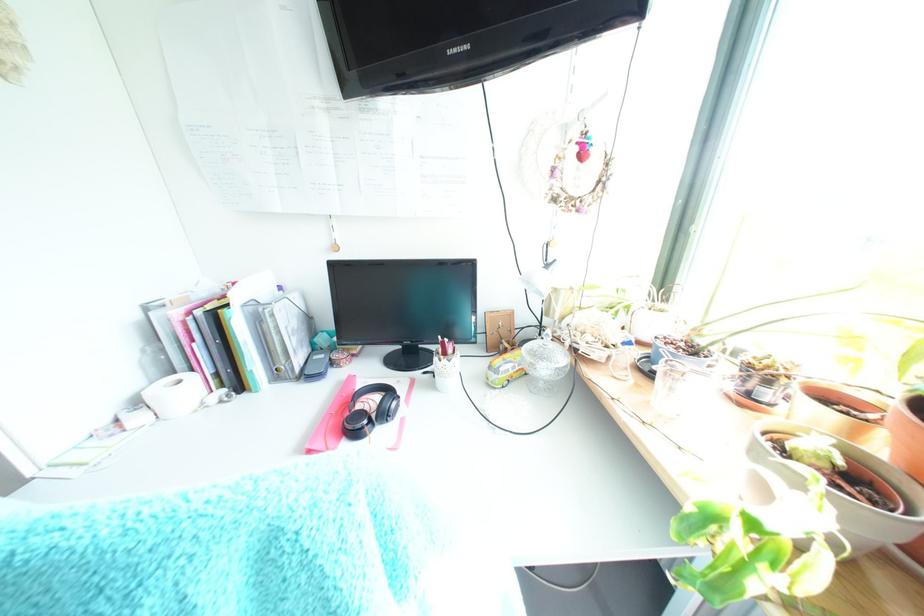
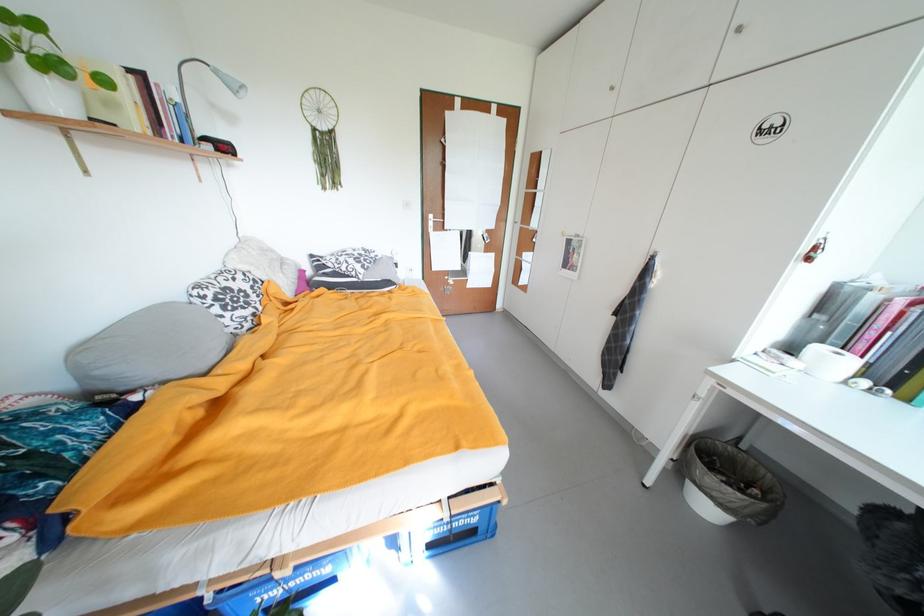
Locate, in the second image, the point that corresponds to [187,384] in the first image.

(845, 355)